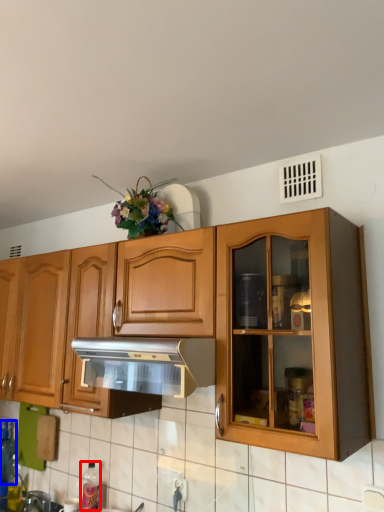
Question: Which object is further to the camera taking this photo, bottle (highlighted by a red box) or bottle (highlighted by a blue box)?

Choices:
 (A) bottle
 (B) bottle

Answer: (B)